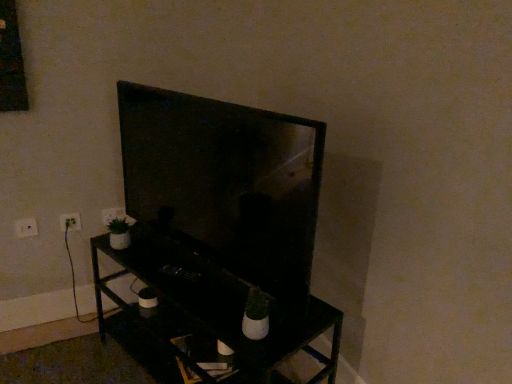
Question: Visually, is white plastic electric outlet at lower left, which is counted as the first electric outlet, starting from the left, positioned to the left or to the right of white plastic electric outlet at left, the 2th electric outlet positioned from the back?

Choices:
 (A) right
 (B) left

Answer: (B)

Question: Is white plastic electric outlet at lower left, the 3th electric outlet when ordered from back to front, inside the boundaries of white plastic electric outlet at left, positioned as the 2th electric outlet in left-to-right order, or outside?

Choices:
 (A) outside
 (B) inside

Answer: (A)

Question: Which object is the closest to the white plastic electric outlet at lower left, the 3th electric outlet when ordered from back to front?

Choices:
 (A) black matte tv stand at center
 (B) white plastic electric outlet at left, positioned as the 2th electric outlet in left-to-right order
 (C) white plastic electric outlet at lower left, the third electric outlet when ordered from left to right
 (D) matte black tv at center

Answer: (B)

Question: Which object is positioned closest to the white plastic electric outlet at left, positioned as the second electric outlet in right-to-left order?

Choices:
 (A) matte black tv at center
 (B) white plastic electric outlet at lower left, the third electric outlet when ordered from left to right
 (C) black matte tv stand at center
 (D) white plastic electric outlet at lower left, which ranks as the 1th electric outlet in front-to-back order

Answer: (D)